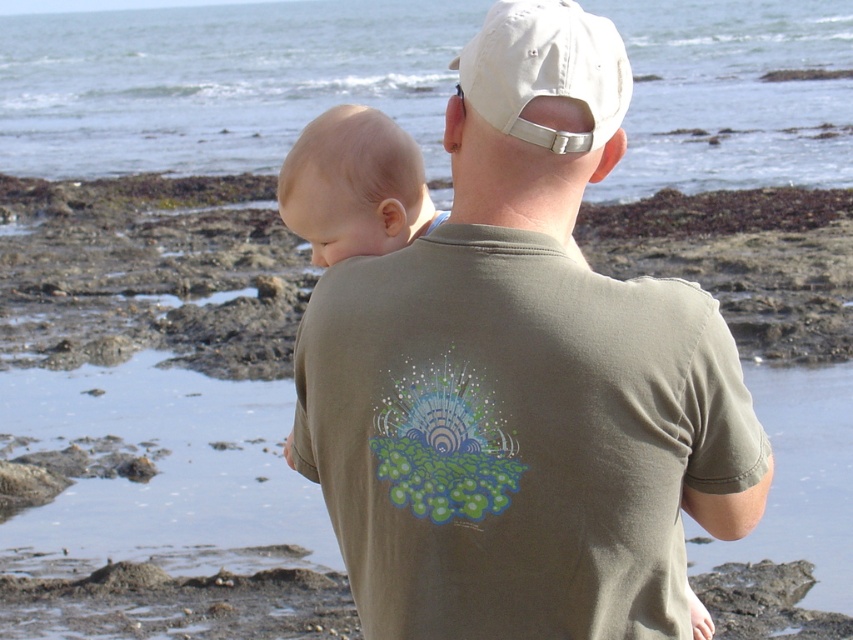
Is point (430, 77) farther from viewer compared to point (598, 93)?

Yes, point (430, 77) is farther from viewer.

The image size is (853, 640). What do you see at coordinates (218, 81) in the screenshot?
I see `clear blue water at upper center` at bounding box center [218, 81].

This screenshot has width=853, height=640. Describe the element at coordinates (218, 81) in the screenshot. I see `clear blue water at upper center` at that location.

At what (x,y) coordinates should I click in order to perform the action: click on clear blue water at upper center. Please return your answer as a coordinate pair (x, y). This screenshot has width=853, height=640. Looking at the image, I should click on (218, 81).

Is clear blue water at upper center positioned before smooth beige baby at center?

Yes.

Is point (700, 12) positioned before point (320, 186)?

No, it is not.

Describe the element at coordinates (218, 81) in the screenshot. I see `clear blue water at upper center` at that location.

The height and width of the screenshot is (640, 853). In order to click on clear blue water at upper center in this screenshot , I will do `click(218, 81)`.

Is point (476, 508) farther from camera compared to point (328, 193)?

That is False.

Is olive green t-shirt at center positioned before smooth beige baby at center?

Yes.

Measure the distance between olive green t-shirt at center and camera.

The distance of olive green t-shirt at center from camera is 2.47 meters.

Image resolution: width=853 pixels, height=640 pixels. Find the location of `olive green t-shirt at center`. olive green t-shirt at center is located at coordinates (521, 378).